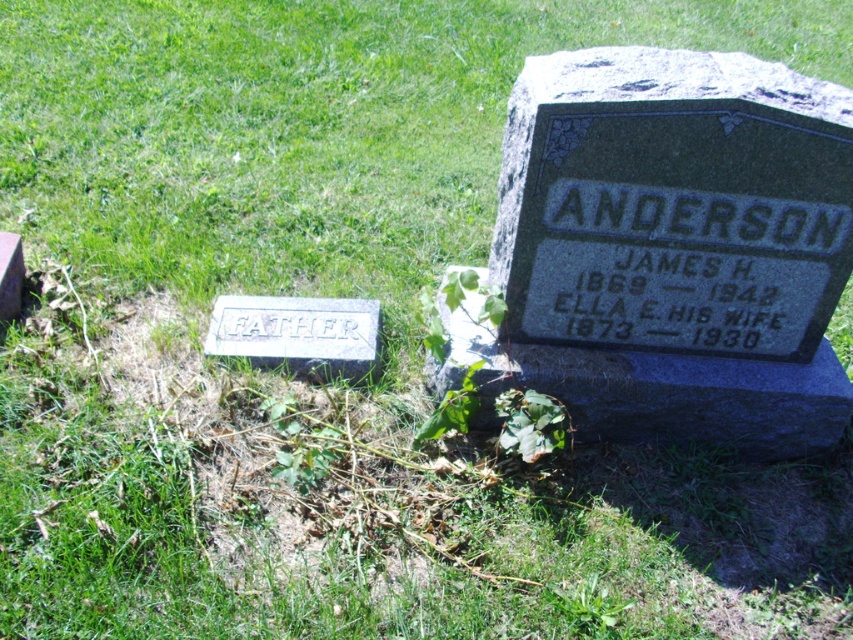
Consider the image. Who is lower down, granite gravestone at center or green leafy weed at center?

green leafy weed at center is below.

Between point (780, 241) and point (541, 396), which one is positioned behind?

The point (541, 396) is more distant.

Image resolution: width=853 pixels, height=640 pixels. What are the coordinates of `granite gravestone at center` in the screenshot? It's located at point(672,248).

Does granite gravestone at center have a lesser height compared to white stone at lower left?

No, granite gravestone at center is not shorter than white stone at lower left.

Does granite gravestone at center appear on the right side of white stone at lower left?

Indeed, granite gravestone at center is positioned on the right side of white stone at lower left.

This screenshot has height=640, width=853. What do you see at coordinates (672, 248) in the screenshot?
I see `granite gravestone at center` at bounding box center [672, 248].

The width and height of the screenshot is (853, 640). I want to click on granite gravestone at center, so click(x=672, y=248).

Which is in front, point (535, 397) or point (459, 397)?

Point (535, 397) is in front.

Is green leafy weed at center above green leafy plant at center?

No.

Measure the distance between green leafy weed at center and camera.

A distance of 2.17 meters exists between green leafy weed at center and camera.

Where is `green leafy weed at center`? This screenshot has height=640, width=853. green leafy weed at center is located at coordinates (531, 422).